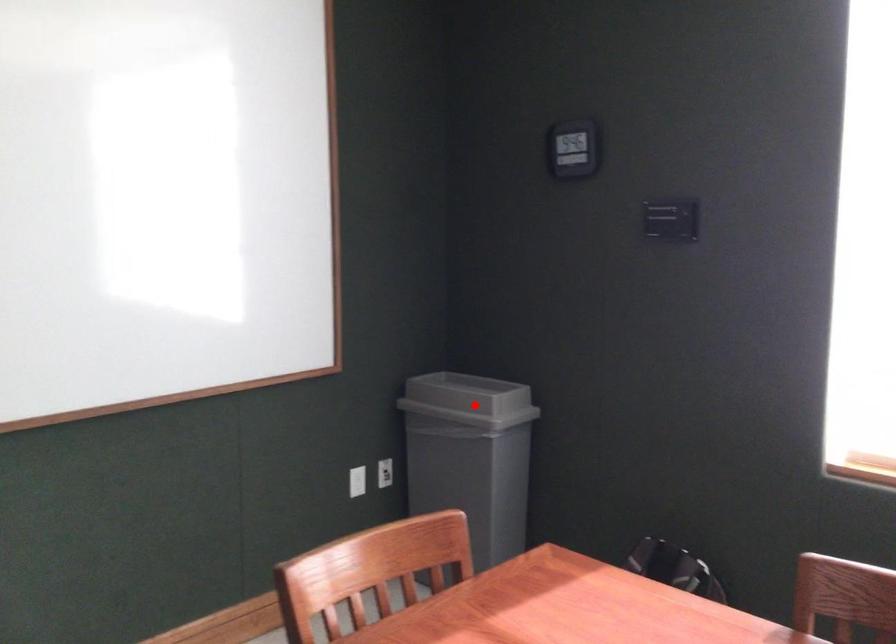
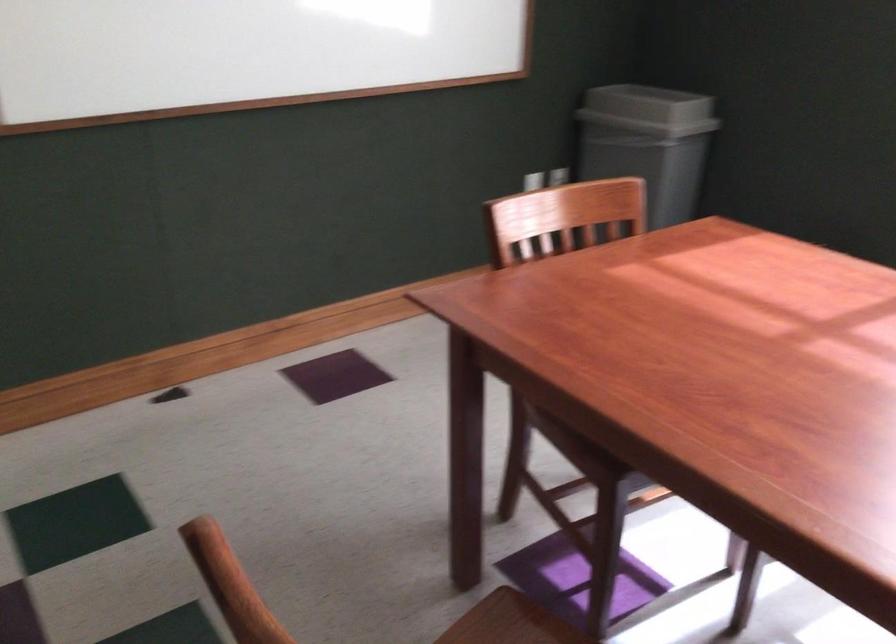
In the second image, find the point that corresponds to the highlighted location in the first image.

(648, 109)